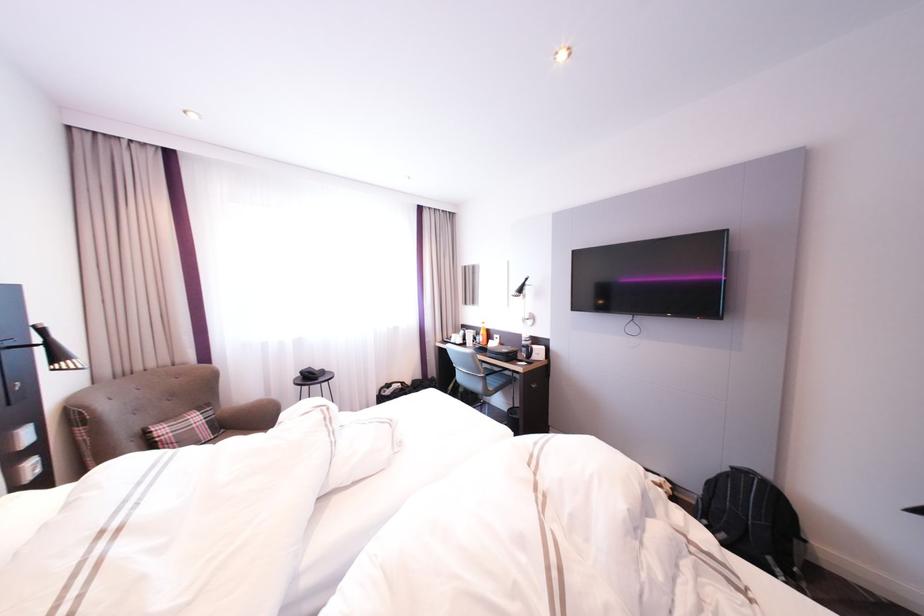
Where is `blue chair sitting surface`? The image size is (924, 616). blue chair sitting surface is located at coordinates (497, 379).